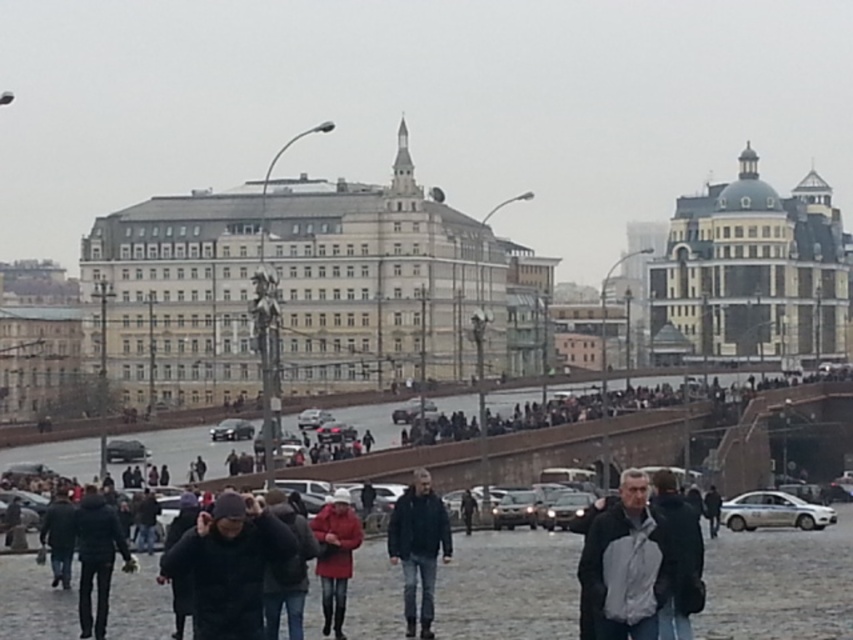
You are standing at the origin point of the image coordinate system, which is the bottom left corner. You want to locate the dark gray knit cap at center. What are its coordinates?

The coordinates of the dark gray knit cap at center are at point (228,564).

You are a photographer standing at the edge of the cobblestone street in the bustling urban scene. You notice two people wearing a dark blue jacket at center and a matte red coat at center. Which of these two items of clothing appears more slender in the image?

The dark blue jacket at center is thinner than the matte red coat at center, so the dark blue jacket at center appears more slender.